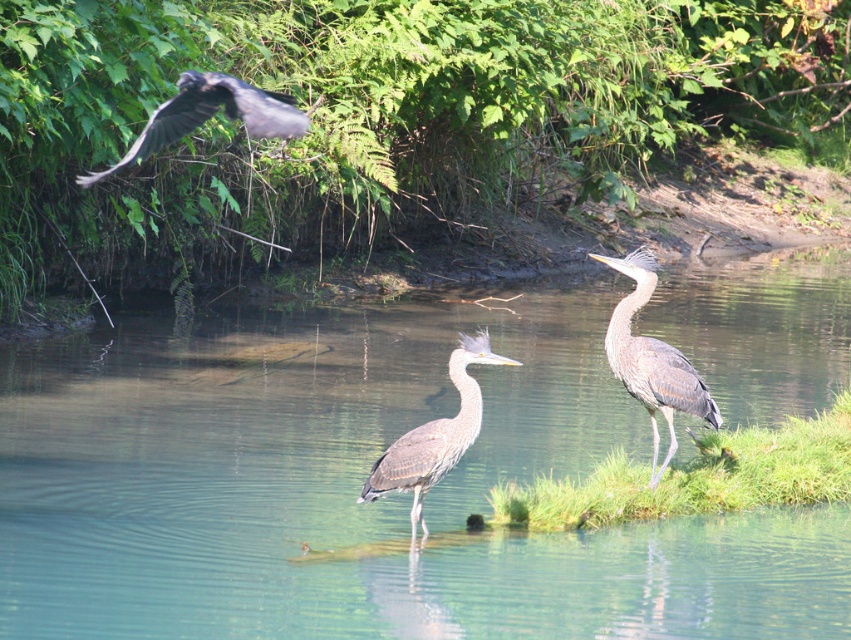
Who is positioned more to the right, gray-brown feathered heron at center-right or gray feathered crow at upper left?

From the viewer's perspective, gray-brown feathered heron at center-right appears more on the right side.

At what (x,y) coordinates should I click in order to perform the action: click on gray-brown feathered heron at center-right. Please return your answer as a coordinate pair (x, y). Image resolution: width=851 pixels, height=640 pixels. Looking at the image, I should click on (652, 358).

Locate an element on the screen. The height and width of the screenshot is (640, 851). gray-brown feathered heron at center-right is located at coordinates (652, 358).

Is gray-brown feathered heron at center-right below gray feathered heron at center?

No, gray-brown feathered heron at center-right is not below gray feathered heron at center.

Which is more to the right, gray-brown feathered heron at center-right or gray feathered heron at center?

From the viewer's perspective, gray-brown feathered heron at center-right appears more on the right side.

Between point (632, 301) and point (477, 387), which one is positioned in front?

Point (477, 387)

I want to click on gray-brown feathered heron at center-right, so click(x=652, y=358).

Can you confirm if clear water at center is shorter than gray feathered heron at center?

Incorrect, clear water at center's height does not fall short of gray feathered heron at center's.

Is point (369, 624) less distant than point (414, 536)?

Yes, point (369, 624) is closer to viewer.

At what (x,y) coordinates should I click in order to perform the action: click on clear water at center. Please return your answer as a coordinate pair (x, y). Looking at the image, I should click on (358, 486).